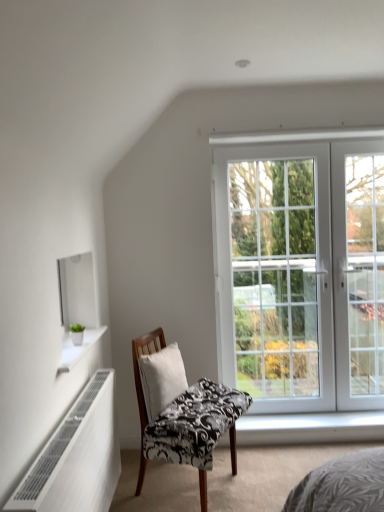
You are a GUI agent. You are given a task and a screenshot of the screen. Output one action in this format:
    pyautogui.click(x=<x>, y=<y>)
    Task: Click on the white metallic radiator at lower left
    Image resolution: width=384 pixels, height=512 pixels.
    Given the screenshot: What is the action you would take?
    pyautogui.click(x=77, y=457)

The image size is (384, 512). I want to click on white glass door at right, so click(358, 272).

Measure the distance between point (215, 398) and camera.

8.12 feet.

The width and height of the screenshot is (384, 512). In order to click on white glass door at right in this screenshot , I will do click(x=301, y=269).

Image resolution: width=384 pixels, height=512 pixels. Describe the element at coordinates (161, 379) in the screenshot. I see `white fabric pillow at center` at that location.

Locate an element on the screen. This screenshot has height=512, width=384. white glossy shelf at upper left is located at coordinates (77, 347).

Locate an element on the screen. The height and width of the screenshot is (512, 384). radiator that appears on the left of white glass door at right is located at coordinates (x=77, y=457).

Which object is closer to the camera taking this photo, white metallic radiator at lower left or white glass door at right?

white metallic radiator at lower left.

Could you tell me if white metallic radiator at lower left is facing white glass door at right?

Yes.

Find the location of a particular element. The width and height of the screenshot is (384, 512). window sill in front of the white fabric pillow at center is located at coordinates (77, 347).

Is white fabric pillow at center spatially inside white glossy shelf at upper left, or outside of it?

white fabric pillow at center is located beyond the bounds of white glossy shelf at upper left.

Considering the sizes of objects white fabric pillow at center and white glossy shelf at upper left in the image provided, who is wider, white fabric pillow at center or white glossy shelf at upper left?

white glossy shelf at upper left is wider.

Is white fabric pillow at center looking in the opposite direction of white glossy shelf at upper left?

No, white glossy shelf at upper left is not at the back of white fabric pillow at center.

From the picture: Is white glossy shelf at upper left at the left side of white glass door at right?

Correct, you'll find white glossy shelf at upper left to the left of white glass door at right.

Choose the correct answer: Is white glossy shelf at upper left inside white glass door at right or outside it?

white glossy shelf at upper left exists outside the volume of white glass door at right.

What's the angular difference between white glossy shelf at upper left and white glass door at right's facing directions?

90.6 degrees.

Where is `screen door above the white glossy shelf at upper left (from a real-world perspective)`? screen door above the white glossy shelf at upper left (from a real-world perspective) is located at coordinates (358, 272).

From a real-world perspective, is black and white patterned chair at center over white glossy shelf at upper left?

Actually, black and white patterned chair at center is physically below white glossy shelf at upper left in the real world.

Considering the sizes of black and white patterned chair at center and white glossy shelf at upper left in the image, is black and white patterned chair at center bigger or smaller than white glossy shelf at upper left?

Considering their sizes, black and white patterned chair at center takes up more space than white glossy shelf at upper left.

From the image's perspective, which object appears higher, black and white patterned chair at center or white glossy shelf at upper left?

white glossy shelf at upper left, from the image's perspective.

You are a GUI agent. You are given a task and a screenshot of the screen. Output one action in this format:
    pyautogui.click(x=<x>, y=<y>)
    Task: Click on the chair that appears on the right of white glossy shelf at upper left
    This screenshot has height=512, width=384.
    Given the screenshot: What is the action you would take?
    point(181,411)

Considering the sizes of objects black and white patterned chair at center and white glass door at right in the image provided, who is taller, black and white patterned chair at center or white glass door at right?

Standing taller between the two is white glass door at right.

From the image's perspective, would you say black and white patterned chair at center is positioned over white glass door at right?

No.

How much distance is there between black and white patterned chair at center and white glass door at right?

1.36 meters.

Where is `chair in front of the white glass door at right`? This screenshot has height=512, width=384. chair in front of the white glass door at right is located at coordinates (181, 411).

In the scene shown: What's the angular difference between white glass door at right and white glossy shelf at upper left's facing directions?

The facing directions of white glass door at right and white glossy shelf at upper left are 90.1 degrees apart.

From a real-world perspective, is white glass door at right positioned under white glossy shelf at upper left based on gravity?

No, from a real-world perspective, white glass door at right is not under white glossy shelf at upper left.

Does white glass door at right contain white glossy shelf at upper left?

Actually, white glossy shelf at upper left is outside white glass door at right.

From the image's perspective, is white glass door at right located beneath white glossy shelf at upper left?

Actually, white glass door at right appears above white glossy shelf at upper left in the image.

Is white glass door at right positioned with its back to white glossy shelf at upper left?

No, white glass door at right is not facing the opposite direction of white glossy shelf at upper left.

Can white glossy shelf at upper left be found inside white glass door at right?

No, white glass door at right does not contain white glossy shelf at upper left.

Does white glass door at right have a smaller size compared to white glossy shelf at upper left?

No.

Identify the location of radiator below the white glass door at right (from a real-world perspective). (77, 457).

Where is `pillow located below the white glossy shelf at upper left (from the image's perspective)`? The width and height of the screenshot is (384, 512). pillow located below the white glossy shelf at upper left (from the image's perspective) is located at coordinates (161, 379).

Looking at the image, which one is located further to white glossy shelf at upper left, white glass door at right or white glass door at right?

white glass door at right lies further to white glossy shelf at upper left than the other object.

Which object lies nearer to the anchor point white glossy shelf at upper left, white glass door at right or black and white patterned chair at center?

The object closer to white glossy shelf at upper left is black and white patterned chair at center.

From the picture: When comparing their distances from white glass door at right, does white glass door at right or black and white patterned chair at center seem further?

Among the two, black and white patterned chair at center is located further to white glass door at right.

When comparing their distances from white glass door at right, does white glass door at right or white metallic radiator at lower left seem further?

white metallic radiator at lower left is positioned further to the anchor white glass door at right.

Which object lies nearer to the anchor point white fabric pillow at center, white metallic radiator at lower left or white glass door at right?

The object closer to white fabric pillow at center is white metallic radiator at lower left.

Which object lies further to the anchor point white glossy shelf at upper left, white glass door at right or white fabric pillow at center?

white glass door at right.

Based on their spatial positions, is black and white patterned chair at center or white metallic radiator at lower left closer to white glass door at right?

black and white patterned chair at center is positioned closer to the anchor white glass door at right.

From the image, which object appears to be nearer to black and white patterned chair at center, white metallic radiator at lower left or white glossy shelf at upper left?

The object closer to black and white patterned chair at center is white metallic radiator at lower left.

You are a GUI agent. You are given a task and a screenshot of the screen. Output one action in this format:
    pyautogui.click(x=<x>, y=<y>)
    Task: Click on the window sill between white metallic radiator at lower left and black and white patterned chair at center along the z-axis
    This screenshot has height=512, width=384.
    Given the screenshot: What is the action you would take?
    pyautogui.click(x=77, y=347)

Locate an element on the screen. pillow between white glossy shelf at upper left and white glass door at right from left to right is located at coordinates (161, 379).

This screenshot has width=384, height=512. I want to click on window positioned between white metallic radiator at lower left and white glass door at right from near to far, so click(x=301, y=269).

In order to click on window located between black and white patterned chair at center and white glass door at right in the left-right direction in this screenshot , I will do (301, 269).